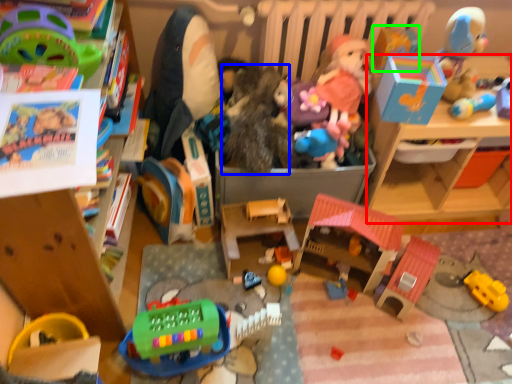
Question: Which object is positioned closest to changing table (highlighted by a red box)? Select from toy (highlighted by a blue box) and toy (highlighted by a green box).

Choices:
 (A) toy
 (B) toy

Answer: (B)